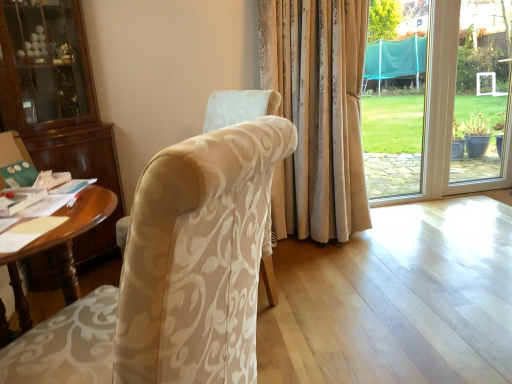
Question: Is wooden desk at left facing away from beige damask fabric chair at center?

Choices:
 (A) no
 (B) yes

Answer: (A)

Question: Is beige damask fabric chair at center a part of wooden desk at left?

Choices:
 (A) no
 (B) yes

Answer: (A)

Question: Does wooden desk at left have a smaller size compared to beige damask fabric chair at center?

Choices:
 (A) no
 (B) yes

Answer: (A)

Question: From the image's perspective, is wooden desk at left located above beige damask fabric chair at center?

Choices:
 (A) no
 (B) yes

Answer: (A)

Question: Is wooden desk at left in front of beige damask fabric chair at center?

Choices:
 (A) no
 (B) yes

Answer: (A)

Question: Is wooden desk at left at the right side of beige damask fabric chair at center?

Choices:
 (A) no
 (B) yes

Answer: (A)

Question: Considering the relative positions of beige damask fabric chair at center and wooden desk at left in the image provided, is beige damask fabric chair at center to the left of wooden desk at left from the viewer's perspective?

Choices:
 (A) no
 (B) yes

Answer: (A)

Question: Are beige damask fabric chair at center and wooden desk at left beside each other?

Choices:
 (A) no
 (B) yes

Answer: (A)

Question: Is beige damask fabric chair at center oriented away from wooden desk at left?

Choices:
 (A) yes
 (B) no

Answer: (B)

Question: Can you confirm if beige damask fabric chair at center is taller than wooden desk at left?

Choices:
 (A) no
 (B) yes

Answer: (B)

Question: Are beige damask fabric chair at center and wooden desk at left far apart?

Choices:
 (A) yes
 (B) no

Answer: (B)

Question: Is beige damask fabric chair at center closer to the viewer compared to wooden desk at left?

Choices:
 (A) yes
 (B) no

Answer: (A)

Question: Relative to beige damask fabric chair at center, is wooden desk at left in front or behind?

Choices:
 (A) front
 (B) behind

Answer: (B)